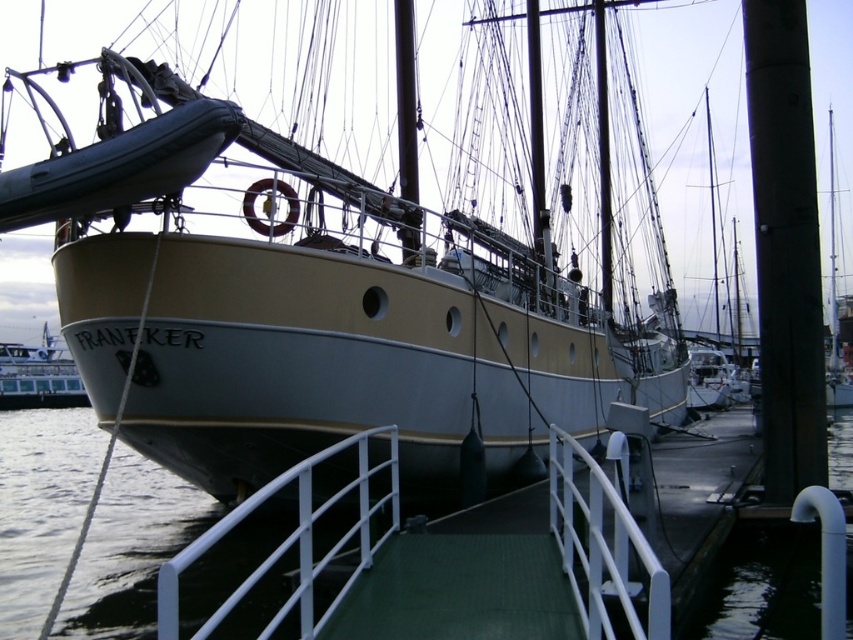
Question: Does white matte rail at center have a lesser width compared to white glossy ferry at lower left?

Choices:
 (A) yes
 (B) no

Answer: (A)

Question: Considering the real-world distances, which object is closest to the white matte rail at center?

Choices:
 (A) white glossy ferry at lower left
 (B) white matte rail at lower center
 (C) smooth gray water at center

Answer: (B)

Question: Which point appears closest to the camera in this image?

Choices:
 (A) (660, 602)
 (B) (67, 392)
 (C) (280, 483)

Answer: (A)

Question: Is smooth gray water at center to the left of white glossy ferry at lower left from the viewer's perspective?

Choices:
 (A) no
 (B) yes

Answer: (A)

Question: Observing the image, what is the correct spatial positioning of smooth gray water at center in reference to white matte rail at center?

Choices:
 (A) left
 (B) right

Answer: (A)

Question: Which is farther from the smooth gray water at center?

Choices:
 (A) white glossy ferry at lower left
 (B) white matte rail at lower center

Answer: (A)